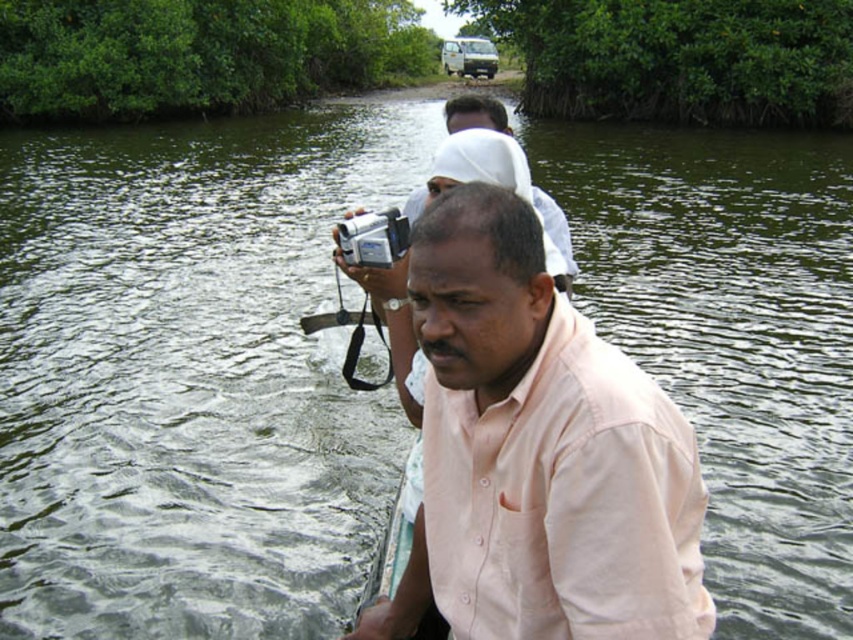
Question: Which point appears farthest from the camera in this image?

Choices:
 (A) (x=584, y=541)
 (B) (x=358, y=262)

Answer: (B)

Question: Is pink cotton shirt at center in front of silver plastic camera at center?

Choices:
 (A) no
 (B) yes

Answer: (B)

Question: Does pink cotton shirt at center have a lesser width compared to silver plastic camera at center?

Choices:
 (A) no
 (B) yes

Answer: (A)

Question: Does pink cotton shirt at center appear under silver plastic camera at center?

Choices:
 (A) no
 (B) yes

Answer: (B)

Question: Which object appears closest to the camera in this image?

Choices:
 (A) pink cotton shirt at center
 (B) silver plastic camera at center

Answer: (A)